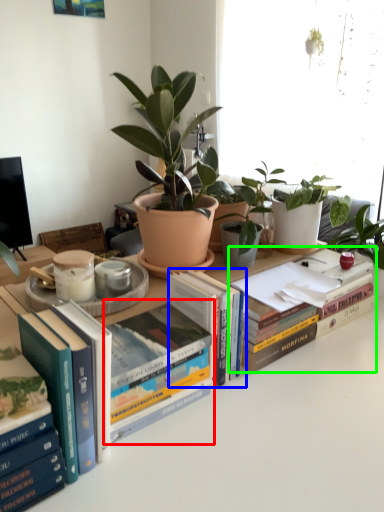
Question: Considering the real-world distances, which object is closest to book (highlighted by a red box)? book (highlighted by a blue box) or book (highlighted by a green box).

Choices:
 (A) book
 (B) book

Answer: (A)